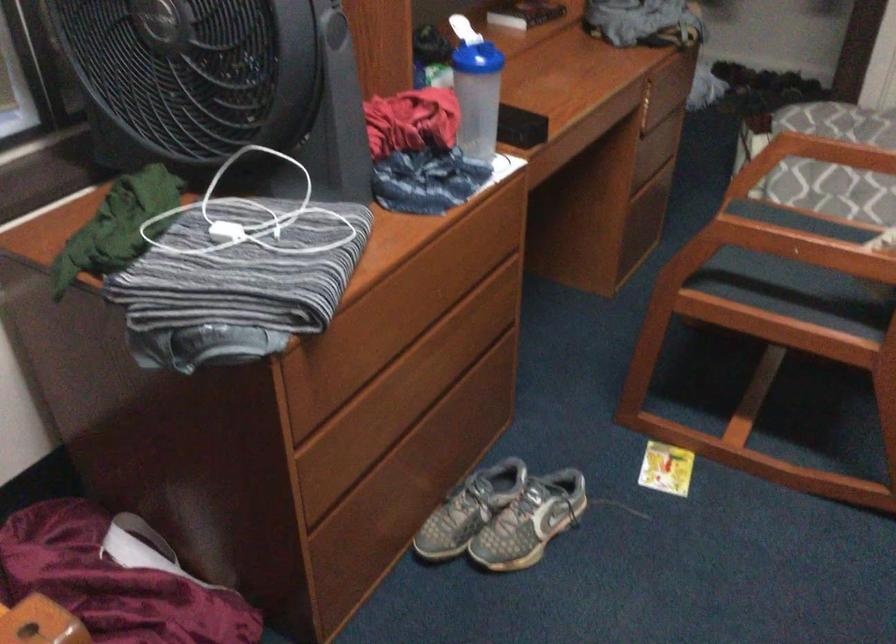
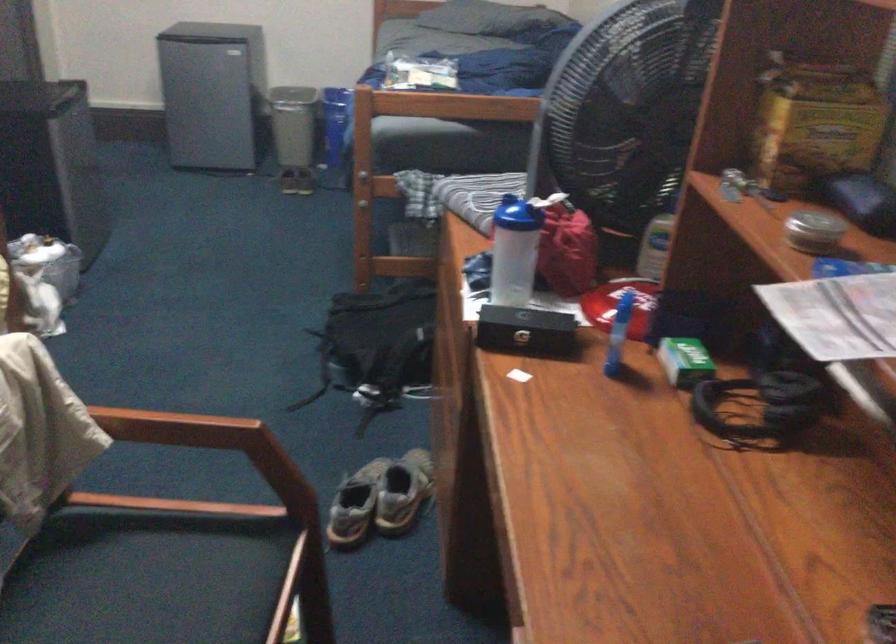
Question: I am providing you with two images of the same scene from different viewpoints. Which of the following objects are not visible in image2?

Choices:
 (A) wooden chair armrest
 (B) black rectangular case
 (C) blue cylindrical object
 (D) none of these

Answer: (D)